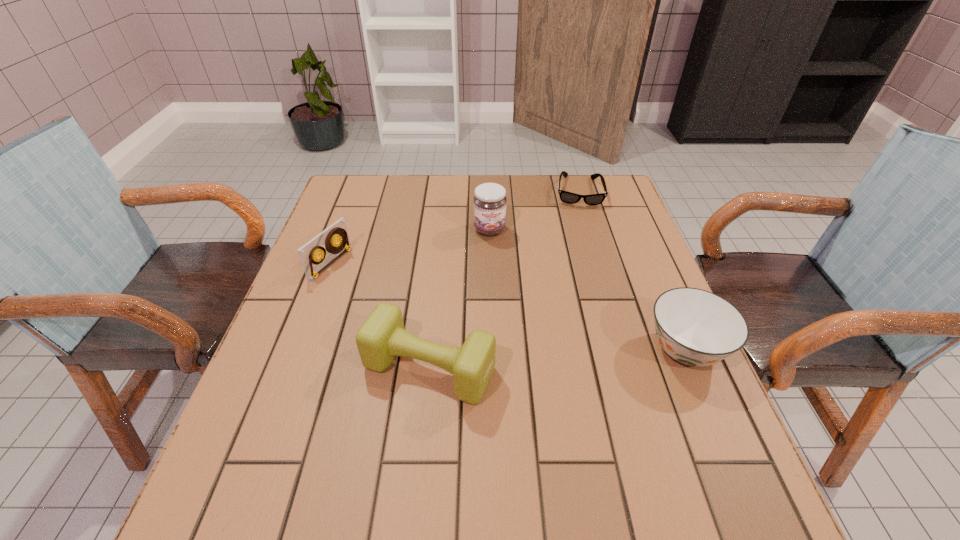
The image size is (960, 540). What are the coordinates of `free space located at the front of the leftmost object with visible reels` in the screenshot? It's located at (394, 294).

Find the location of a particular element. Image resolution: width=960 pixels, height=540 pixels. vacant space located at the front of the leftmost object with visible reels is located at coordinates (477, 330).

Where is `free space located on the front label of the fourth nearest object`? This screenshot has width=960, height=540. free space located on the front label of the fourth nearest object is located at coordinates (497, 255).

The image size is (960, 540). I want to click on vacant region located 0.130m on the front label of the fourth nearest object, so click(502, 271).

Identify the location of free space located 0.280m on the front label of the fourth nearest object. The width and height of the screenshot is (960, 540). (516, 314).

I want to click on vacant region located 0.330m on the front-facing side of the sunglasses, so click(x=584, y=282).

You are a GUI agent. You are given a task and a screenshot of the screen. Output one action in this format:
    pyautogui.click(x=<x>, y=<y>)
    Task: Click on the free space located on the front-facing side of the sunglasses
    
    Given the screenshot: What is the action you would take?
    pyautogui.click(x=584, y=291)

At what (x,y) coordinates should I click in order to perform the action: click on vacant space located 0.250m on the front-facing side of the sunglasses. Please return your answer as a coordinate pair (x, y). The width and height of the screenshot is (960, 540). Looking at the image, I should click on (583, 261).

Where is `object present at the far edge`? The width and height of the screenshot is (960, 540). object present at the far edge is located at coordinates (567, 197).

Where is `object that is at the left edge`? Image resolution: width=960 pixels, height=540 pixels. object that is at the left edge is located at coordinates (310, 261).